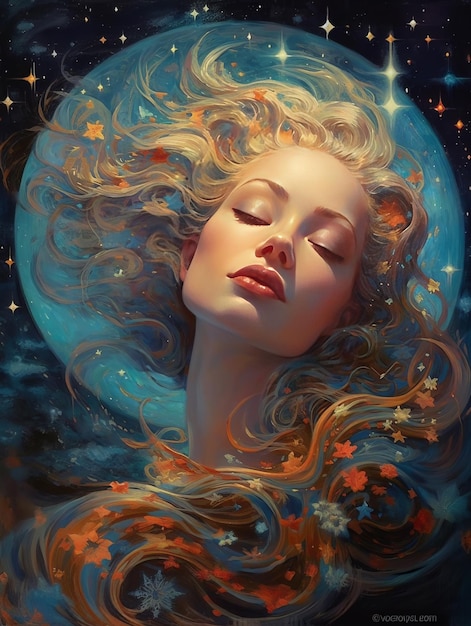
Locate an element on the screen. painting is located at coordinates [261, 418].